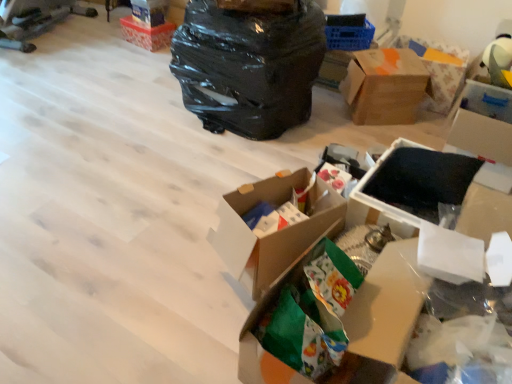
Find the location of a particular element. vacant region to the left of cardboard box at center, the fourth box when ordered from back to front is located at coordinates (174, 253).